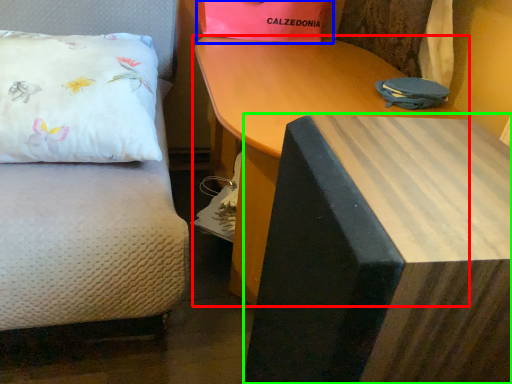
Question: Estimate the real-world distances between objects in this image. Which object is farther from table (highlighted by a red box), gift bag (highlighted by a blue box) or table (highlighted by a green box)?

Choices:
 (A) gift bag
 (B) table

Answer: (B)